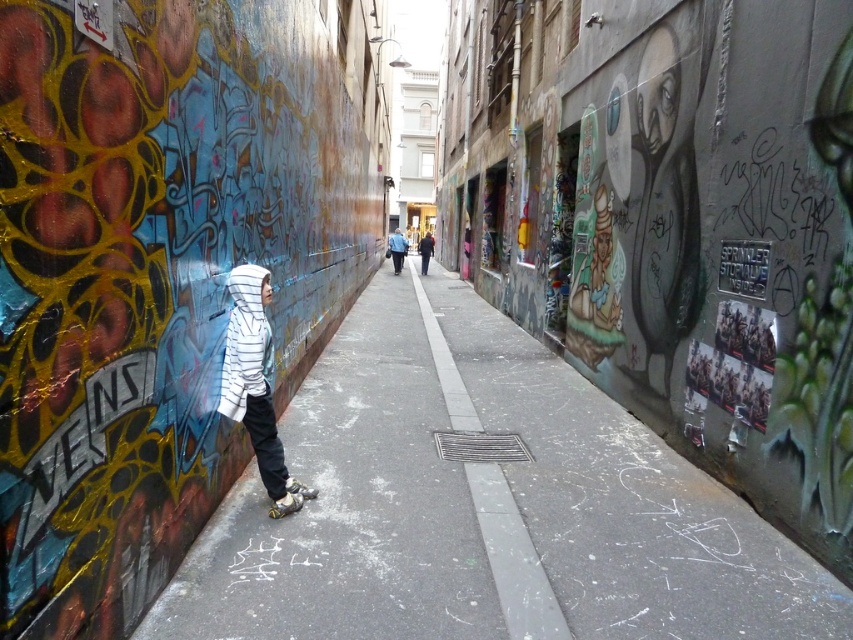
Does matte black skateboard at lower center have a greater width compared to blue denim jacket at center?

Incorrect, matte black skateboard at lower center's width does not surpass blue denim jacket at center's.

Is point (289, 502) positioned before point (397, 236)?

That is True.

I want to click on matte black skateboard at lower center, so click(291, 499).

Is white striped hoodie at left wider than matte black skateboard at lower center?

Correct, the width of white striped hoodie at left exceeds that of matte black skateboard at lower center.

Who is more distant from viewer, (280, 442) or (309, 492)?

Positioned behind is point (309, 492).

This screenshot has width=853, height=640. Find the location of `white striped hoodie at left`. white striped hoodie at left is located at coordinates (256, 385).

In the scene shown: Who is more distant from viewer, (527, 531) or (247, 337)?

The point (527, 531) is more distant.

Is the position of smooth asphalt pavement at center more distant than that of white striped hoodie at left?

No.

Image resolution: width=853 pixels, height=640 pixels. Identify the location of smooth asphalt pavement at center. (483, 506).